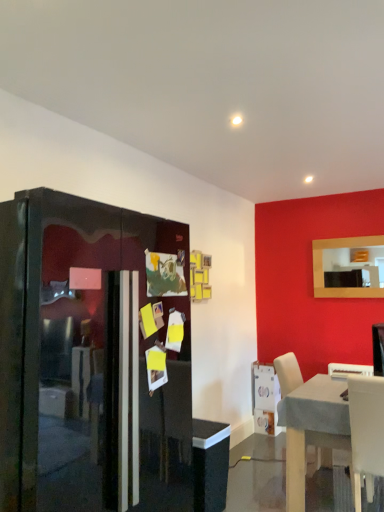
Question: Is white plastic chair at lower right, which is the second chair in back-to-front order, wider or thinner than light wood table at lower right?

Choices:
 (A) thin
 (B) wide

Answer: (A)

Question: Based on their sizes in the image, would you say white plastic chair at lower right, which is the second chair in back-to-front order, is bigger or smaller than light wood table at lower right?

Choices:
 (A) small
 (B) big

Answer: (A)

Question: Which of these objects is positioned farthest from the light wood table at lower right?

Choices:
 (A) white plastic chair at lower right, which is the second chair in back-to-front order
 (B) white glossy microwave at lower right
 (C) glossy black fridge at left
 (D) white plastic chair at lower right, marked as the 1th chair in a top-to-bottom arrangement
 (E) matte wooden mirror at upper right

Answer: (E)

Question: Estimate the real-world distances between objects in this image. Which object is closer to the white plastic chair at lower right, which is the second chair from front to back?

Choices:
 (A) light wood table at lower right
 (B) matte wooden mirror at upper right
 (C) white glossy microwave at lower right
 (D) glossy black fridge at left
 (E) white plastic chair at lower right, acting as the first chair starting from the bottom

Answer: (A)